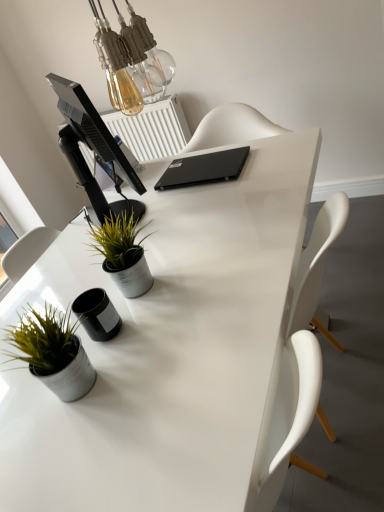
Question: Is the position of black matte laptop at center less distant than that of matte gray pot at lower left, marked as the first houseplant in a front-to-back arrangement?

Choices:
 (A) no
 (B) yes

Answer: (A)

Question: From the image's perspective, is black matte laptop at center over matte gray pot at lower left, which is the 2th houseplant from top to bottom?

Choices:
 (A) yes
 (B) no

Answer: (A)

Question: From a real-world perspective, is black matte laptop at center physically below matte gray pot at lower left, marked as the 2th houseplant in a back-to-front arrangement?

Choices:
 (A) yes
 (B) no

Answer: (A)

Question: Is black matte laptop at center turned away from matte gray pot at lower left, which is the 2th houseplant from top to bottom?

Choices:
 (A) no
 (B) yes

Answer: (B)

Question: Can you confirm if black matte laptop at center is bigger than matte gray pot at lower left, which is the 2th houseplant from top to bottom?

Choices:
 (A) yes
 (B) no

Answer: (B)

Question: From the image's perspective, relative to black glossy monitor at upper left, is black matte laptop at center above or below?

Choices:
 (A) above
 (B) below

Answer: (A)

Question: In the image, is black matte laptop at center positioned in front of or behind black glossy monitor at upper left?

Choices:
 (A) front
 (B) behind

Answer: (B)

Question: Based on their positions, is black matte laptop at center located to the left or right of black glossy monitor at upper left?

Choices:
 (A) left
 (B) right

Answer: (B)

Question: Would you say black matte laptop at center is inside or outside black glossy monitor at upper left?

Choices:
 (A) outside
 (B) inside

Answer: (A)

Question: From a real-world perspective, is black glossy monitor at upper left above or below white glossy desk at center?

Choices:
 (A) below
 (B) above

Answer: (B)

Question: Is black glossy monitor at upper left to the left or to the right of white glossy desk at center in the image?

Choices:
 (A) left
 (B) right

Answer: (A)

Question: Considering the positions of black glossy monitor at upper left and white glossy desk at center in the image, is black glossy monitor at upper left bigger or smaller than white glossy desk at center?

Choices:
 (A) small
 (B) big

Answer: (A)

Question: From the image's perspective, is black glossy monitor at upper left positioned above or below white glossy desk at center?

Choices:
 (A) below
 (B) above

Answer: (B)

Question: Is point (140, 124) positioned closer to the camera than point (155, 382)?

Choices:
 (A) closer
 (B) farther

Answer: (B)

Question: From the image's perspective, is white plastic radiator at upper center located above or below white glossy desk at center?

Choices:
 (A) above
 (B) below

Answer: (A)